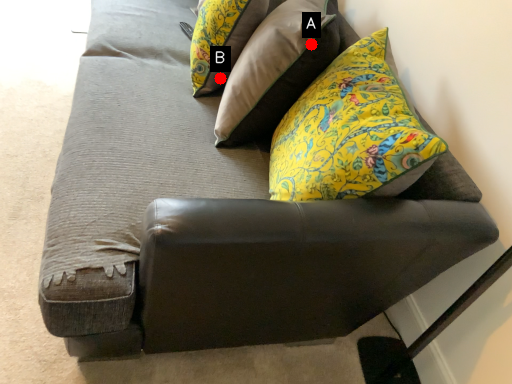
Question: Two points are circled on the image, labeled by A and B beside each circle. Among these points, which one is farthest from the camera?

Choices:
 (A) A is further
 (B) B is further

Answer: (B)